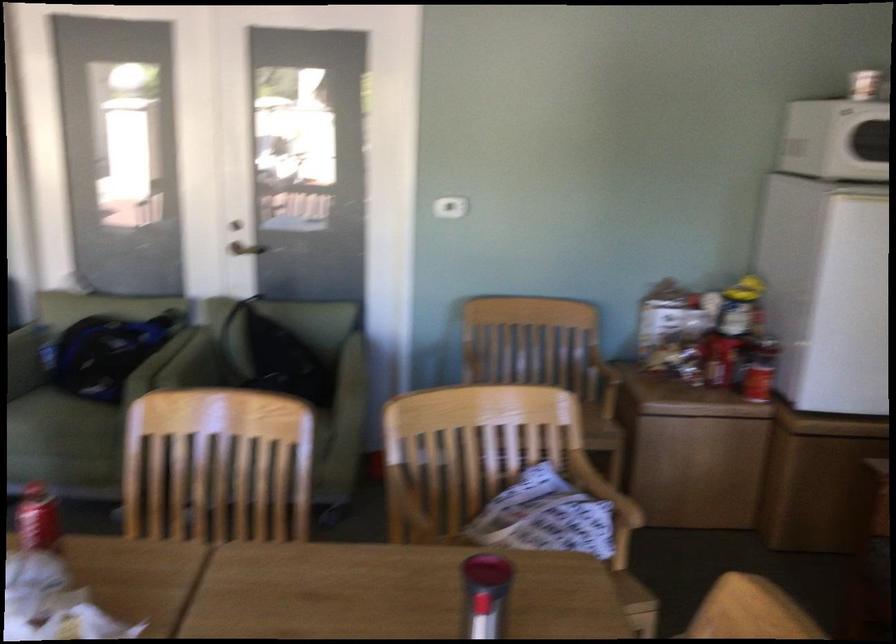
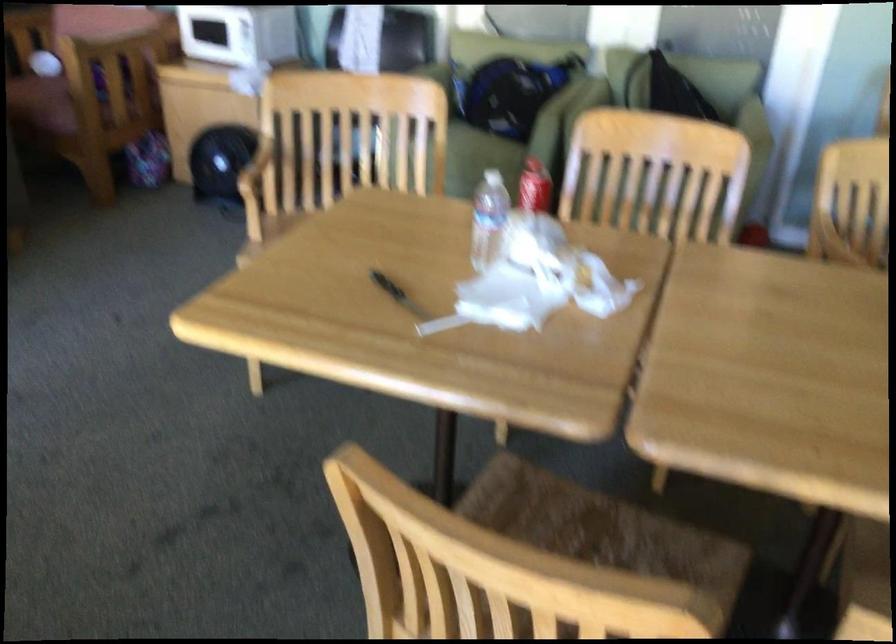
The point at (x=222, y=456) is marked in the first image. Where is the corresponding point in the second image?

(655, 174)